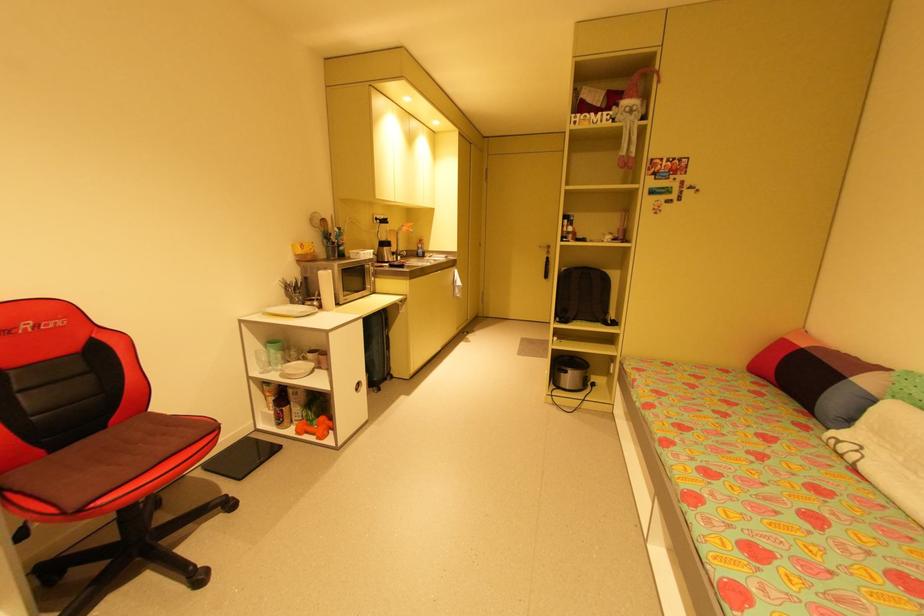
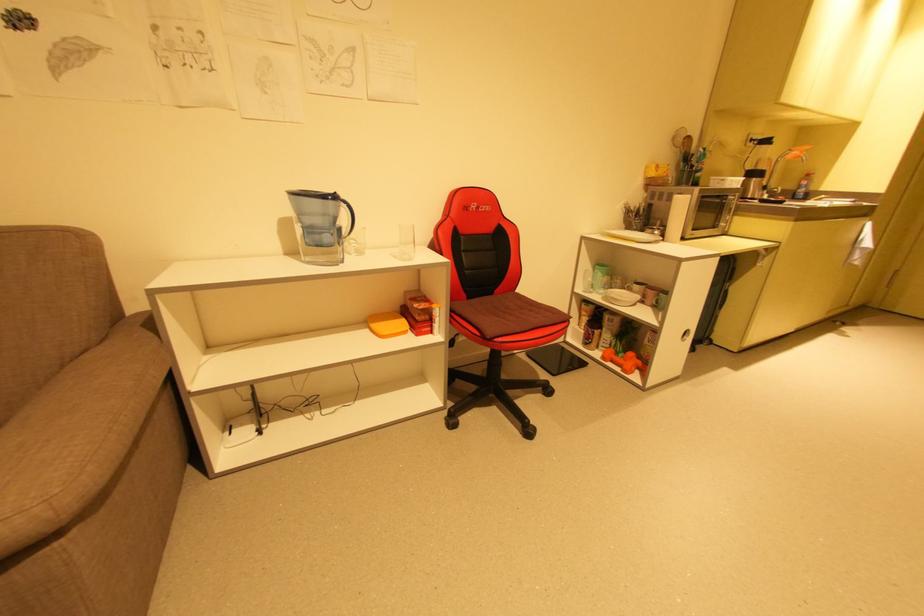
The point at [107,429] is marked in the first image. Where is the corresponding point in the second image?

(495, 294)